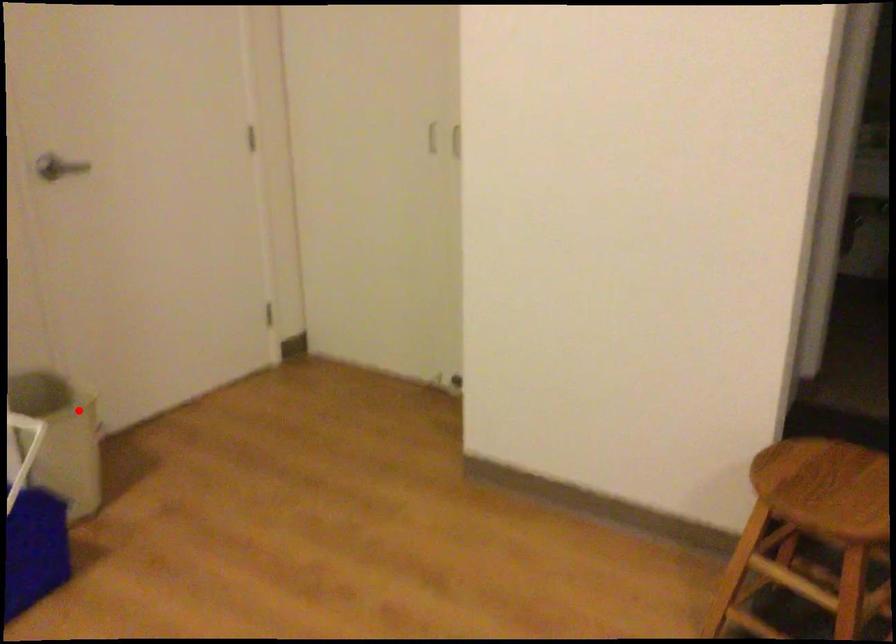
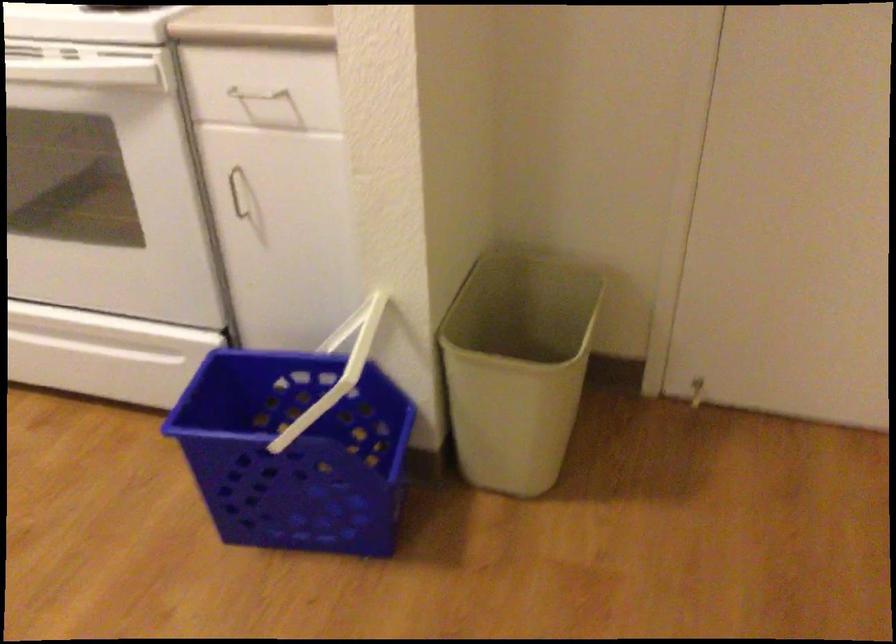
Question: A red point is marked in image1. In image2, is the corresponding 3D point closer to the camera or farther? Reply with the corresponding letter.

Choices:
 (A) The corresponding 3D point is closer.
 (B) The corresponding 3D point is farther.

Answer: (A)